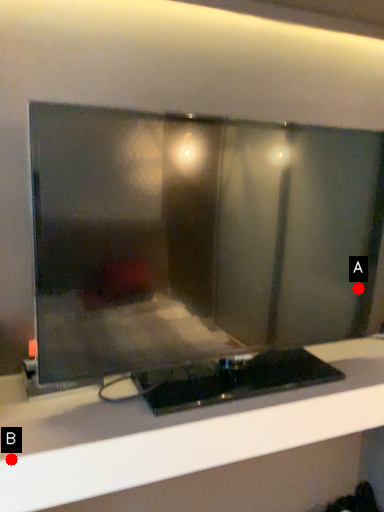
Question: Two points are circled on the image, labeled by A and B beside each circle. Which point appears farthest from the camera in this image?

Choices:
 (A) A is further
 (B) B is further

Answer: (A)